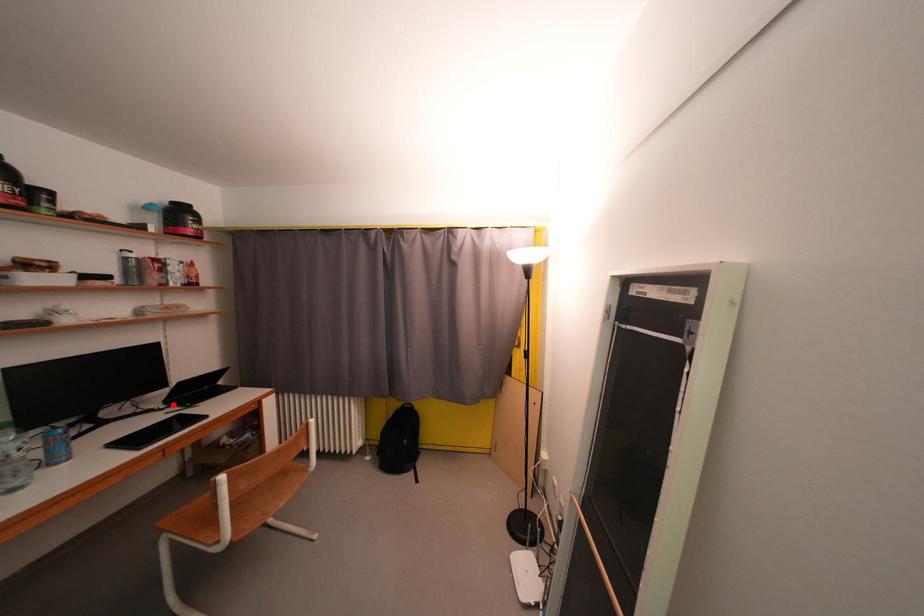
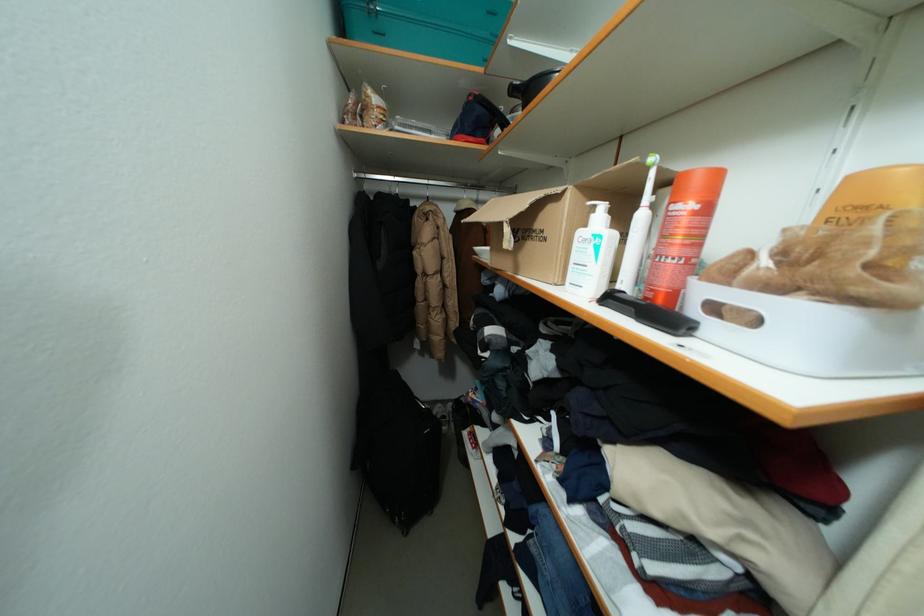
Question: I am providing you with two images of the same scene from different viewpoints. A red point is marked on the first image. Can you still see the location of the red point in image 2?

Choices:
 (A) Yes
 (B) No

Answer: (B)